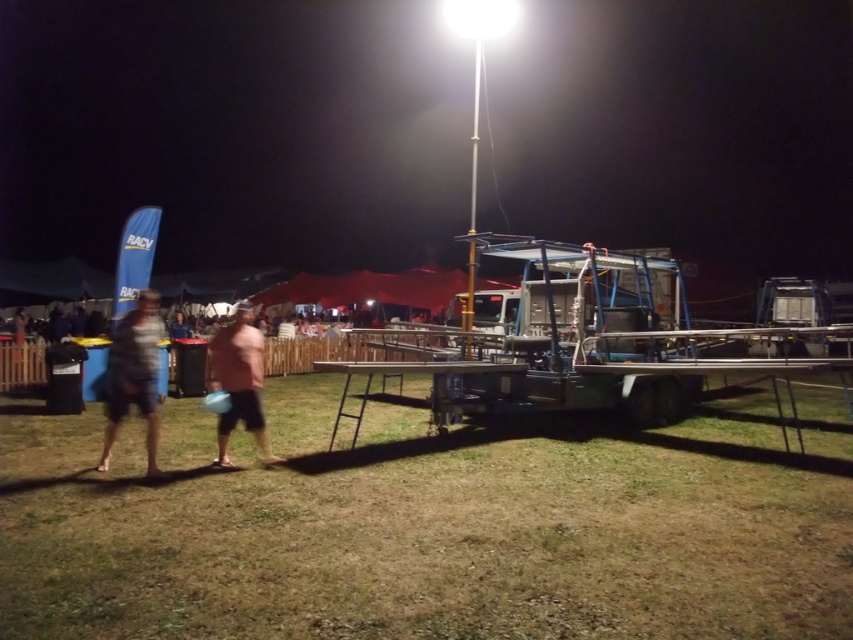
You are standing in the nighttime scene with the green grass at lower center and the pink matte shirt at center. Which object is closer to you?

The green grass at lower center is closer to the viewer than the pink matte shirt at center.

You are standing in the nighttime scene with the floodlight. You see the gray fabric shorts at lower left and the pink matte shirt at center. Which object is closer to the ground?

The gray fabric shorts at lower left is below pink matte shirt at center, so it is closer to the ground.